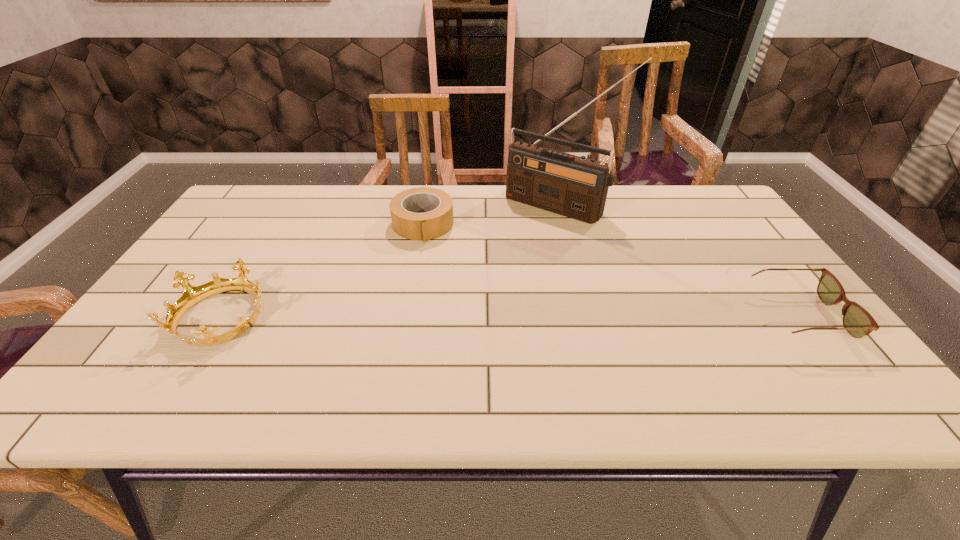
Find the location of a particular element. vacant space on the desktop that is between the crown and the rightmost object and is positioned on the front-facing side of the third object from left to right is located at coordinates [x=459, y=316].

Image resolution: width=960 pixels, height=540 pixels. I want to click on free space on the desktop that is between the leftmost object and the spectacles and is positioned at the edge of the duct tape, so click(441, 316).